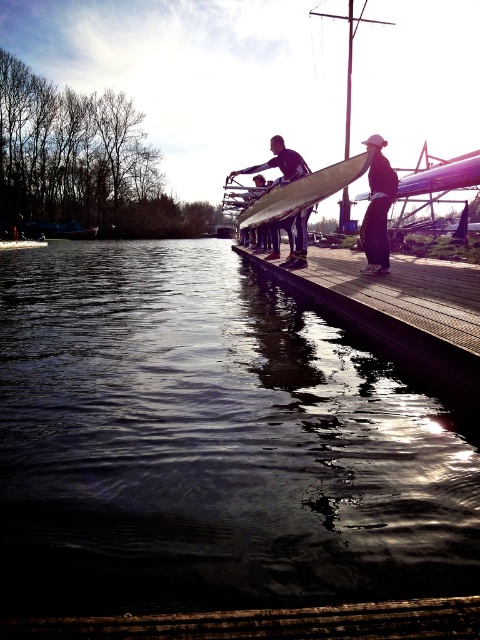
Which of these two, wooden dock at center or smooth white surfboard at center, stands taller?

Standing taller between the two is wooden dock at center.

Where is `wooden dock at center`? This screenshot has height=640, width=480. wooden dock at center is located at coordinates (396, 291).

Does wooden dock at center lie in front of black matte surfboard at center?

Yes, wooden dock at center is in front of black matte surfboard at center.

Between point (402, 282) and point (368, 228), which one is positioned behind?

Positioned behind is point (368, 228).

Looking at this image, measure the distance between point [436,308] and camera.

Point [436,308] is 16.18 feet away from camera.

Locate an element on the screen. The height and width of the screenshot is (640, 480). wooden dock at center is located at coordinates (396, 291).

Who is shorter, dark reflective water at center or black matte surfboard at center?

black matte surfboard at center

Which of these two, dark reflective water at center or black matte surfboard at center, stands taller?

dark reflective water at center

This screenshot has width=480, height=640. I want to click on dark reflective water at center, so click(211, 444).